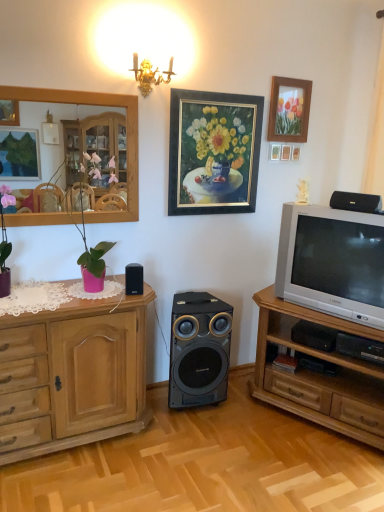
Locate an element on the screen. free space between black plastic speaker at center, marked as the first loudspeaker in a bottom-to-top arrangement, and wooden cabinet at left is located at coordinates (170, 410).